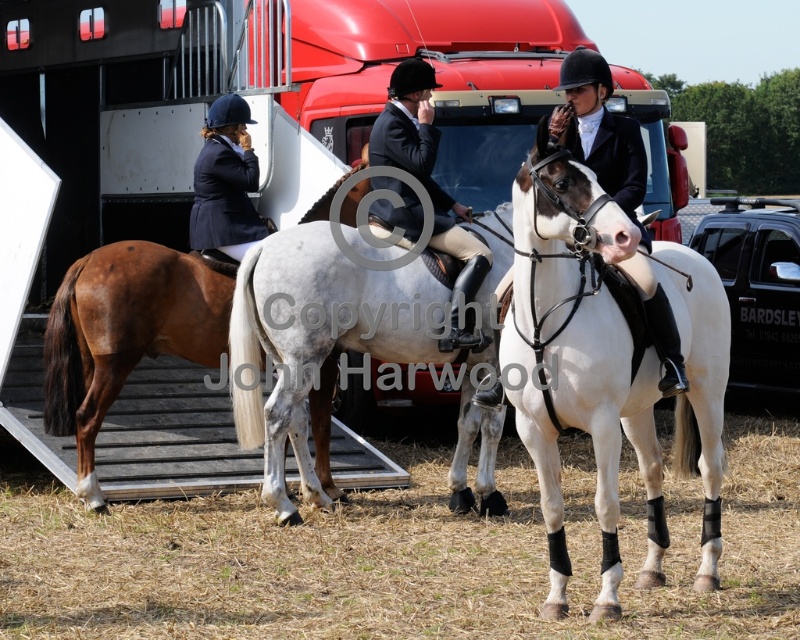
Who is taller, white glossy horse at center or navy blue riding jacket at upper left?

Standing taller between the two is white glossy horse at center.

Is point (624, 387) less distant than point (226, 248)?

That is True.

In order to click on white glossy horse at center in this screenshot , I will do `click(578, 362)`.

Where is `matte black jacket at center`? The image size is (800, 640). matte black jacket at center is located at coordinates (429, 182).

Looking at this image, is matte black jacket at center shorter than navy blue riding jacket at upper left?

No.

You are a GUI agent. You are given a task and a screenshot of the screen. Output one action in this format:
    pyautogui.click(x=<x>, y=<y>)
    Task: Click on the matte black jacket at center
    This screenshot has height=640, width=800.
    Given the screenshot: What is the action you would take?
    pyautogui.click(x=429, y=182)

Is the position of black leather jacket at center more distant than that of navy blue riding jacket at upper left?

No, black leather jacket at center is closer to the viewer.

Who is more distant from viewer, (686, 387) or (206, 186)?

Point (206, 186)

What do you see at coordinates (616, 186) in the screenshot? I see `black leather jacket at center` at bounding box center [616, 186].

Where is `black leather jacket at center`? Image resolution: width=800 pixels, height=640 pixels. black leather jacket at center is located at coordinates (616, 186).